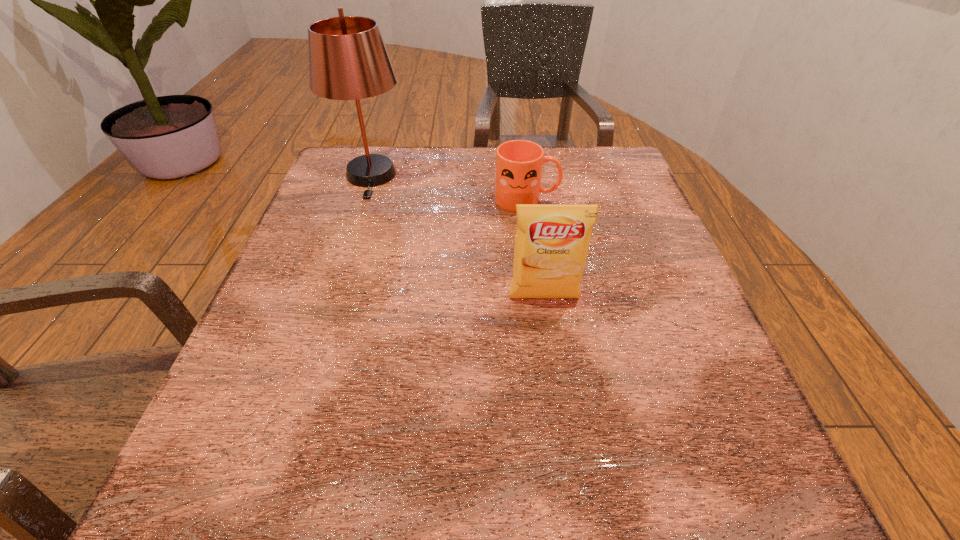
Locate an element on the screen. The height and width of the screenshot is (540, 960). vacant area that lies between the second tallest object and the tallest object is located at coordinates (457, 237).

You are a GUI agent. You are given a task and a screenshot of the screen. Output one action in this format:
    pyautogui.click(x=<x>, y=<y>)
    Task: Click on the free spot between the tallest object and the shortest object
    The image size is (960, 540).
    Given the screenshot: What is the action you would take?
    pyautogui.click(x=448, y=188)

Locate an element on the screen. The height and width of the screenshot is (540, 960). blank region between the lampshade and the mug is located at coordinates [448, 188].

Locate an element on the screen. This screenshot has width=960, height=540. empty space between the lampshade and the nearest object is located at coordinates (457, 237).

The height and width of the screenshot is (540, 960). I want to click on unoccupied area between the tallest object and the second tallest object, so click(x=457, y=237).

This screenshot has width=960, height=540. In order to click on the closest object to the tallest object in this screenshot , I will do `click(519, 163)`.

Where is `the second closest object relative to the crisp (potato chip)`? The image size is (960, 540). the second closest object relative to the crisp (potato chip) is located at coordinates (348, 60).